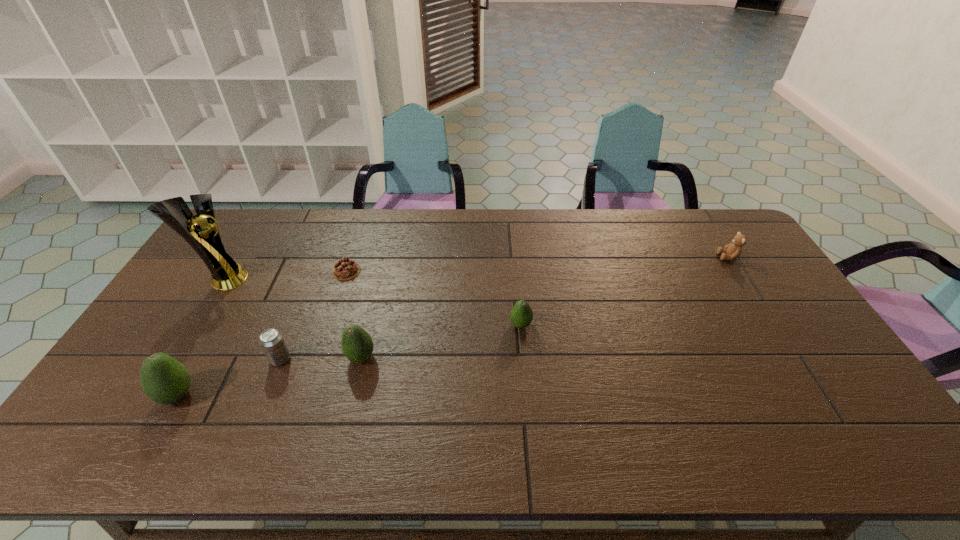
Locate an element on the screen. Image resolution: width=960 pixels, height=540 pixels. vacant region at the far right corner of the desktop is located at coordinates (706, 244).

In order to click on blank region between the chocolate cake and the second avocado from left to right in this screenshot , I will do `click(354, 314)`.

I want to click on vacant area between the second tallest object and the rightmost object, so click(x=453, y=326).

Identify the location of free space between the teddy bear and the fifth object from right to left. The height and width of the screenshot is (540, 960). (505, 308).

This screenshot has height=540, width=960. I want to click on unoccupied position between the chocolate cake and the teddy bear, so click(x=538, y=264).

Identify the location of vacant space that is in between the fifth object from right to left and the leftmost avocado. The height and width of the screenshot is (540, 960). (229, 377).

Where is `free space between the nearest object and the teddy bear`? The image size is (960, 540). free space between the nearest object and the teddy bear is located at coordinates (453, 326).

Where is `vacant area that lies between the fourth object from left to right and the second object from right to left`? vacant area that lies between the fourth object from left to right and the second object from right to left is located at coordinates point(434,298).

Locate which object is the sixth closest to the beer can. Please provide its 2D coordinates. Your answer should be formatted as a tuple, i.e. [(x, y)], where the tuple contains the x and y coordinates of a point satisfying the conditions above.

[(732, 251)]

Choose which object is the second nearest neighbor to the leftmost avocado. Please provide its 2D coordinates. Your answer should be formatted as a tuple, i.e. [(x, y)], where the tuple contains the x and y coordinates of a point satisfying the conditions above.

[(226, 274)]